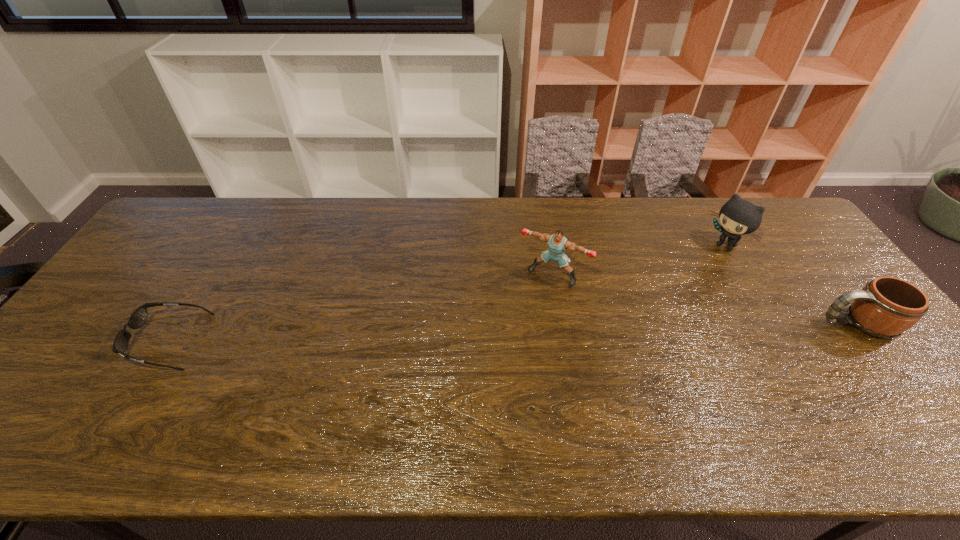
This screenshot has height=540, width=960. What are the coordinates of `free space on the desktop that is between the sunglasses and the rightmost object and is positioned on the front-facing side of the kitten` in the screenshot? It's located at (607, 330).

The height and width of the screenshot is (540, 960). Find the location of `vacant space on the desktop that is between the shortest object and the second shortest object and is positioned on the front-facing side of the second object from left to right`. vacant space on the desktop that is between the shortest object and the second shortest object and is positioned on the front-facing side of the second object from left to right is located at coordinates (518, 332).